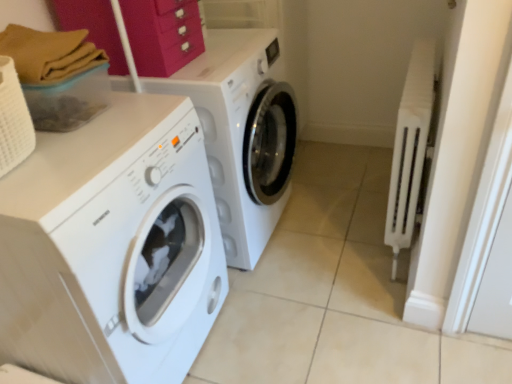
This screenshot has height=384, width=512. Identify the location of vacant space behind white plastic radiator at right. (361, 189).